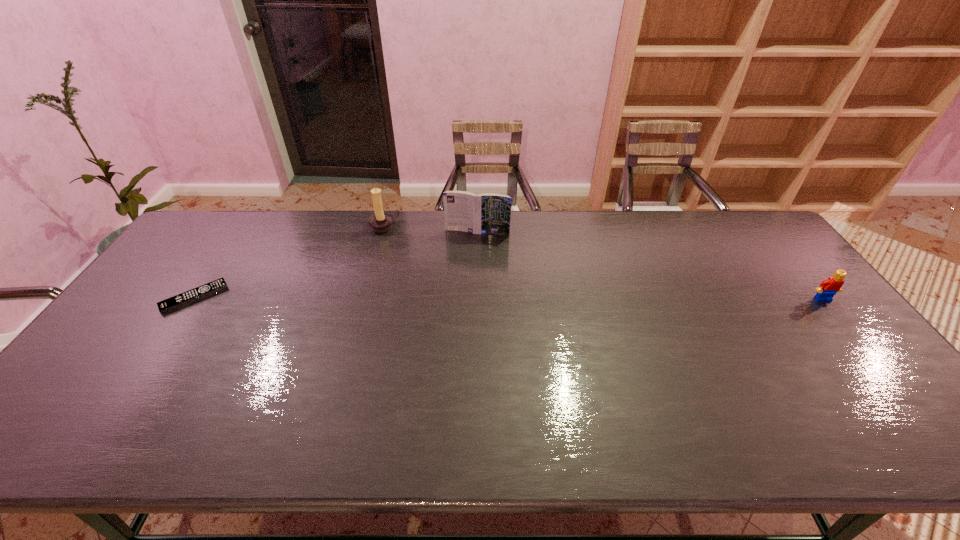
Locate an element on the screen. This screenshot has height=540, width=960. the leftmost object is located at coordinates (198, 293).

The height and width of the screenshot is (540, 960). In order to click on the shortest object in this screenshot , I will do `click(198, 293)`.

Find the location of a particular element. the rightmost object is located at coordinates (828, 288).

I want to click on Lego, so click(828, 288).

I want to click on book, so click(x=489, y=213).

This screenshot has height=540, width=960. Identify the location of the second object from left to right. (381, 221).

Where is `blank area located 0.190m on the back of the shortest object`? This screenshot has height=540, width=960. blank area located 0.190m on the back of the shortest object is located at coordinates tap(231, 243).

You are a GUI agent. You are given a task and a screenshot of the screen. Output one action in this format:
    pyautogui.click(x=<x>, y=<y>)
    Task: Click on the free space located on the front-facing side of the Lego
    Image resolution: width=960 pixels, height=540 pixels.
    Given the screenshot: What is the action you would take?
    pyautogui.click(x=883, y=374)

Where is `vacant space located 0.360m on the front cover of the second object from right to left`? This screenshot has width=960, height=540. vacant space located 0.360m on the front cover of the second object from right to left is located at coordinates (452, 312).

Find the location of a particular element. The width and height of the screenshot is (960, 540). free point located 0.250m on the front cover of the second object from right to left is located at coordinates (459, 285).